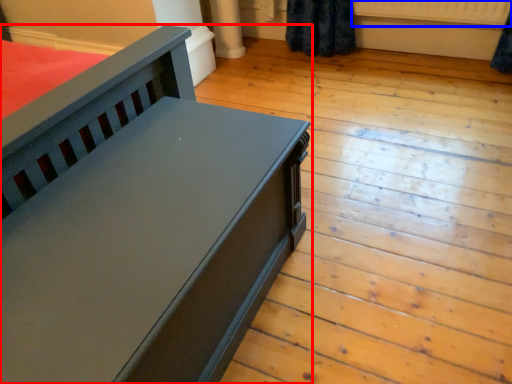
Question: Which object is closer to the camera taking this photo, furniture (highlighted by a red box) or radiator (highlighted by a blue box)?

Choices:
 (A) furniture
 (B) radiator

Answer: (A)